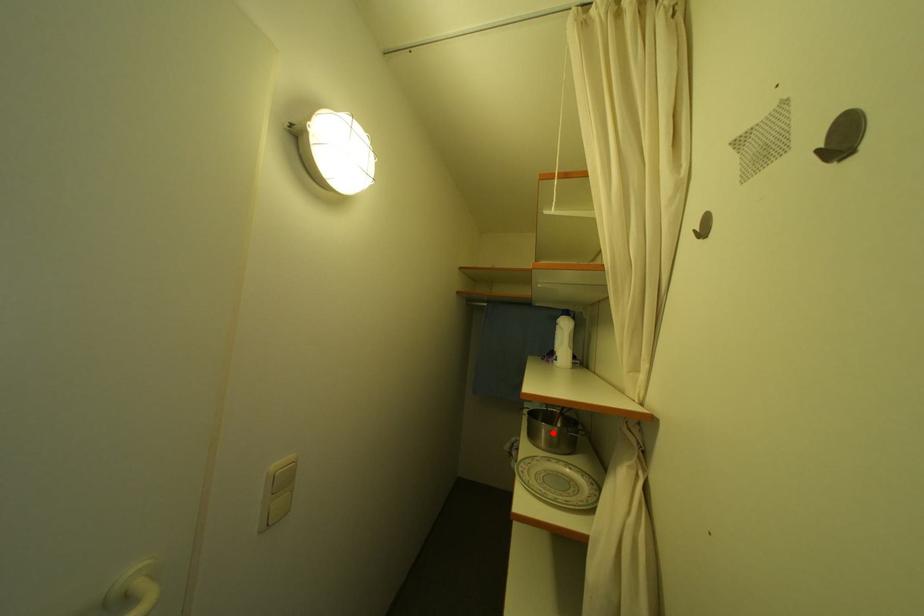
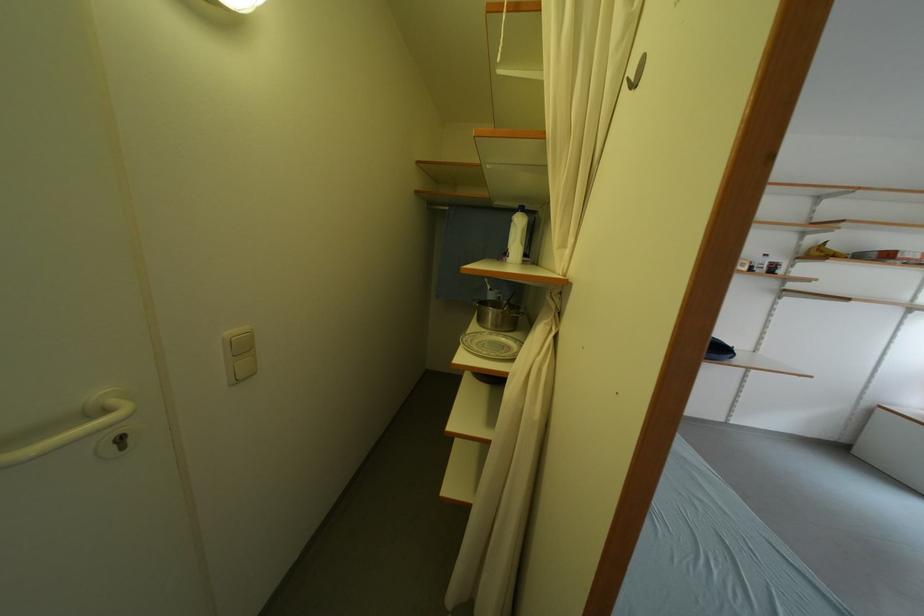
Question: I am providing you with two images of the same scene from different viewpoints. A red point is shown in image1. For the corresponding object point in image2, is it positioned nearer or farther from the camera?

Choices:
 (A) Nearer
 (B) Farther

Answer: (A)